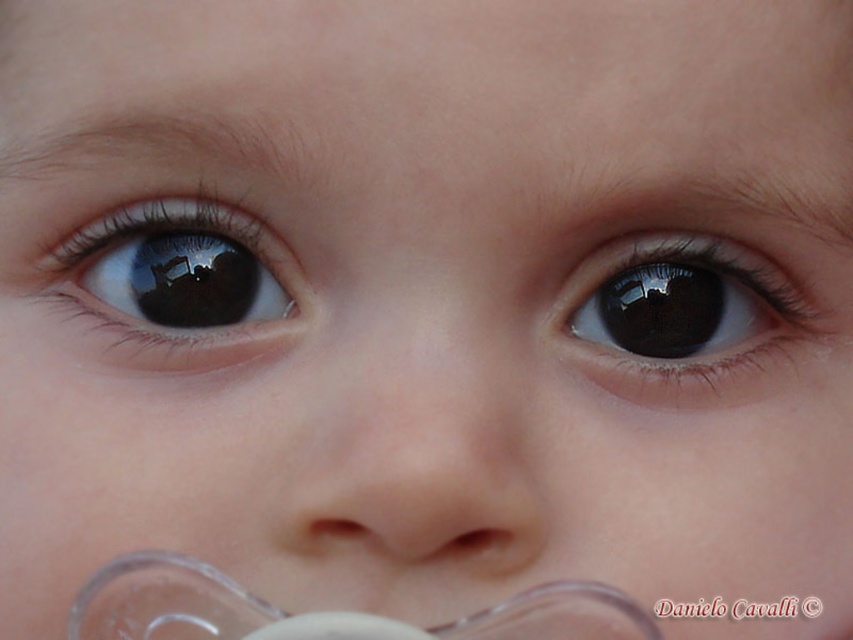
Question: Which point is farther from the camera taking this photo?

Choices:
 (A) (223, 584)
 (B) (175, 284)
 (C) (712, 371)
 (D) (421, 364)

Answer: (C)

Question: Is the position of smooth flesh nose at center less distant than that of black glossy eye at upper right?

Choices:
 (A) yes
 (B) no

Answer: (A)

Question: Is blue glossy eye at upper left smaller than transparent plastic pacifier at lower center?

Choices:
 (A) yes
 (B) no

Answer: (A)

Question: Can you confirm if black glossy eye at upper right is positioned above blue glossy eye at upper left?

Choices:
 (A) yes
 (B) no

Answer: (B)

Question: Which point is farther from the camera taking this photo?

Choices:
 (A) (483, 428)
 (B) (708, 387)

Answer: (B)

Question: Which point is farther from the camera taking this photo?

Choices:
 (A) (405, 317)
 (B) (515, 612)

Answer: (A)